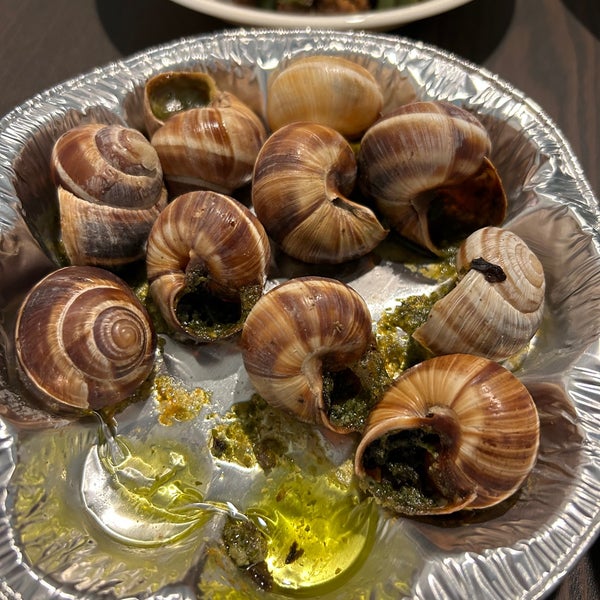
The width and height of the screenshot is (600, 600). Identify the location of table. (50, 48).